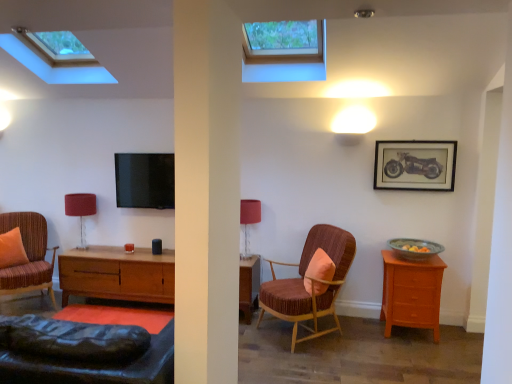
You are a GUI agent. You are given a task and a screenshot of the screen. Output one action in this format:
    pyautogui.click(x=<x>, y=<y>)
    Task: Click on the vacant area that lies between light brown wood nightstand at right and velvet-like brown armchair at center, the 1th chair viewed from the right
    
    Given the screenshot: What is the action you would take?
    pyautogui.click(x=358, y=341)